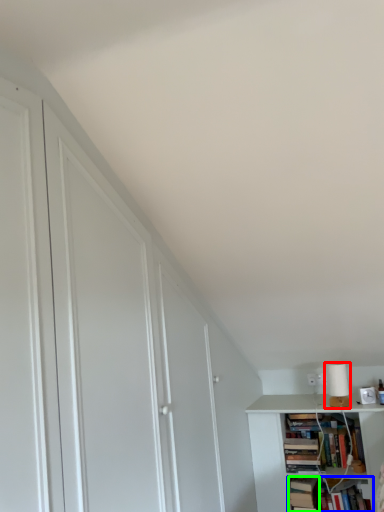
Question: Which object is the closest to the lamp (highlighted by a red box)? Choose among these: book (highlighted by a blue box) or book (highlighted by a green box).

Choices:
 (A) book
 (B) book

Answer: (A)